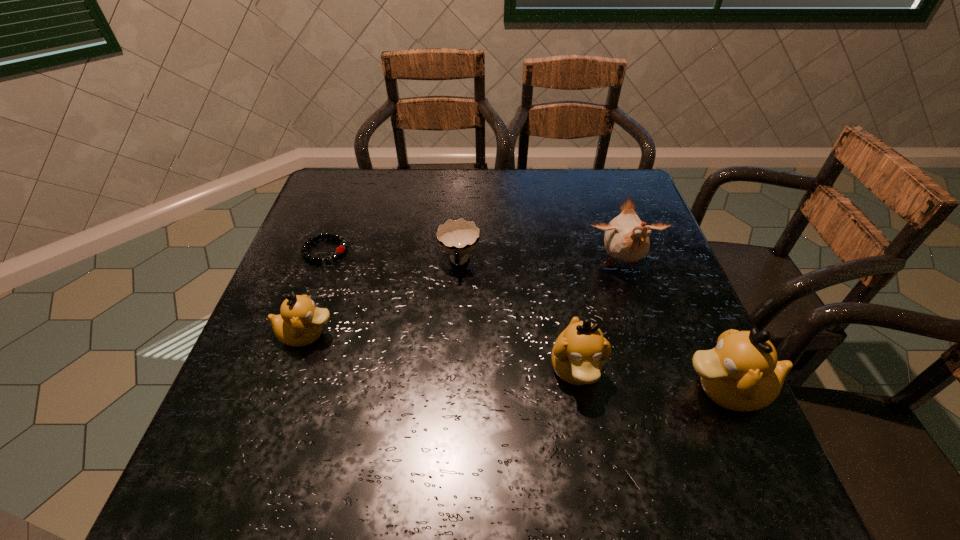
Where is `spot to insert another duckling for uniform distribution`? Image resolution: width=960 pixels, height=540 pixels. spot to insert another duckling for uniform distribution is located at coordinates (437, 352).